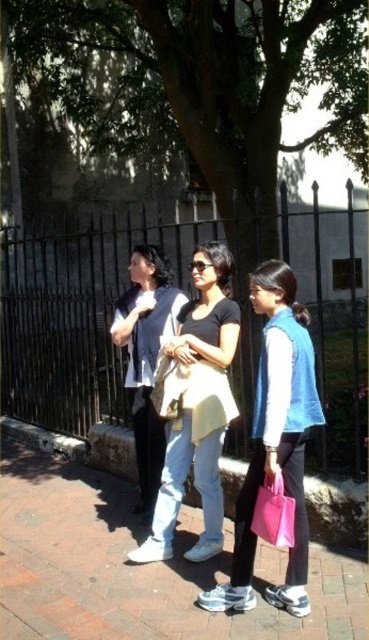
You are a fashion designer observing the scene. You notice two people wearing matte yellow shirt at center and matte white shirt at center. Which of these two shirts is shorter in length?

The matte yellow shirt at center is shorter than the matte white shirt at center.

You are a photographer trying to capture a photo of the matte yellow shirt at center and the matte white shirt at center. Since they are both in the same area, which one is closer to the camera?

The matte yellow shirt at center is in front of the matte white shirt at center, so it is closer to the camera.